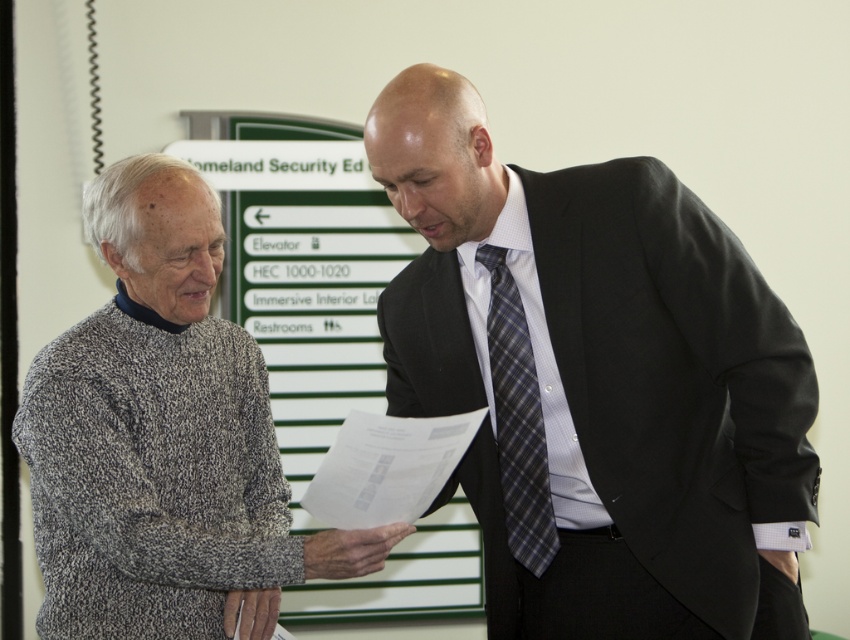
Is matte black suit at center closer to the viewer compared to speckled wool sweater at left?

Yes, matte black suit at center is in front of speckled wool sweater at left.

Who is lower down, matte black suit at center or speckled wool sweater at left?

speckled wool sweater at left

Between point (514, 369) and point (207, 577), which one is positioned in front?

Point (207, 577) is in front.

Locate an element on the screen. This screenshot has width=850, height=640. matte black suit at center is located at coordinates (596, 381).

Which is behind, point (673, 420) or point (371, 493)?

The point (673, 420) is more distant.

Who is more distant from viewer, (556, 275) or (329, 518)?

The point (329, 518) is more distant.

Locate an element on the screen. matte black suit at center is located at coordinates (596, 381).

Between point (89, 202) and point (537, 460), which one is positioned in front?

Point (537, 460) is in front.

Between speckled wool sweater at left and plaid fabric tie at center, which one appears on the left side from the viewer's perspective?

speckled wool sweater at left

Find the location of a particular element. speckled wool sweater at left is located at coordinates (163, 440).